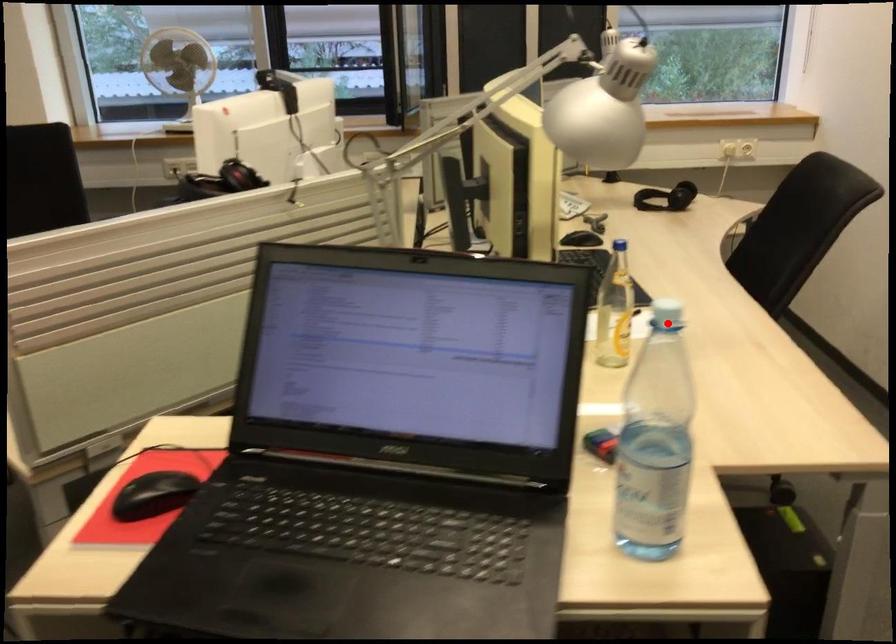
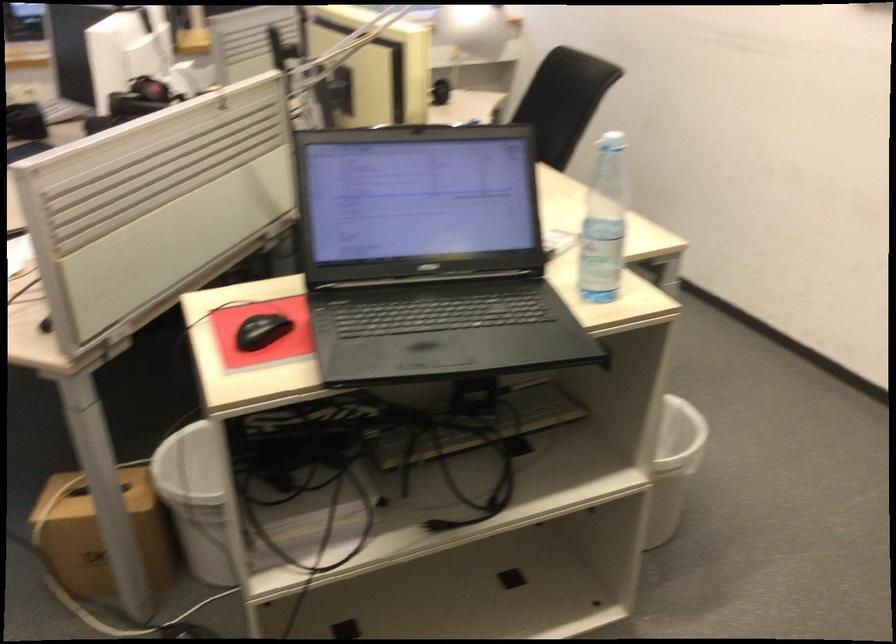
The point at the highlighted location is marked in the first image. Where is the corresponding point in the second image?

(612, 142)